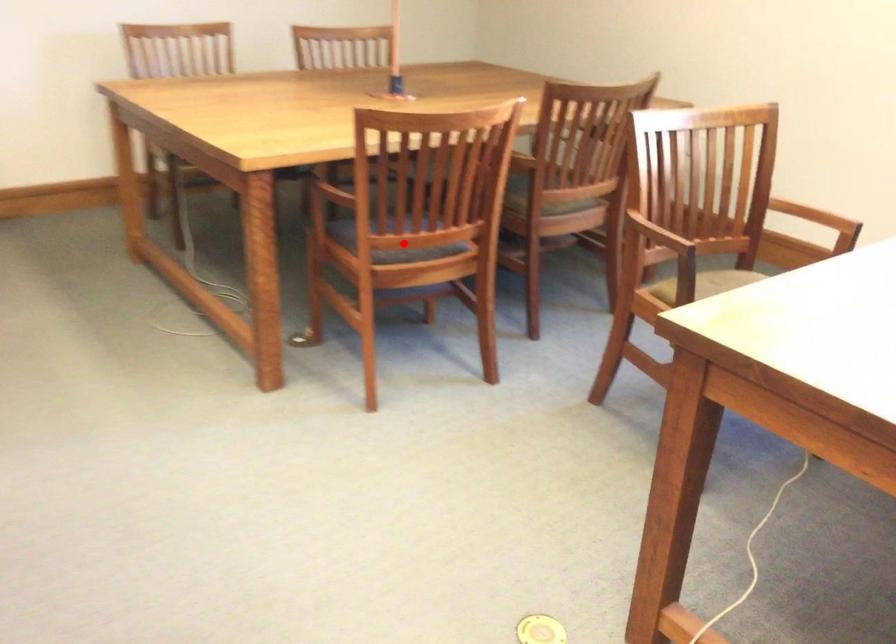
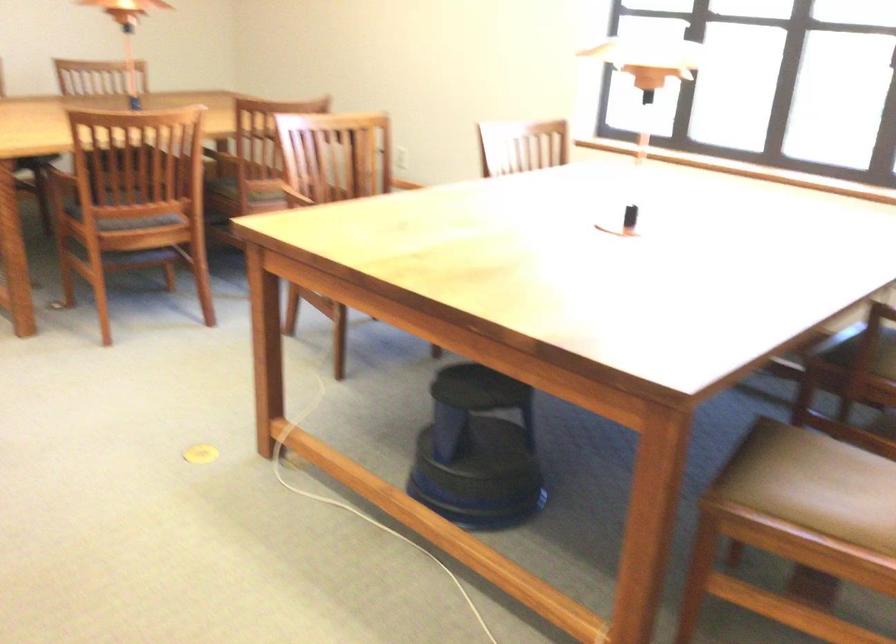
Question: I am providing you with two images of the same scene from different viewpoints. Given a red point in image1, look at the same physical point in image2. Is it:

Choices:
 (A) Closer to the viewpoint
 (B) Farther from the viewpoint

Answer: (B)